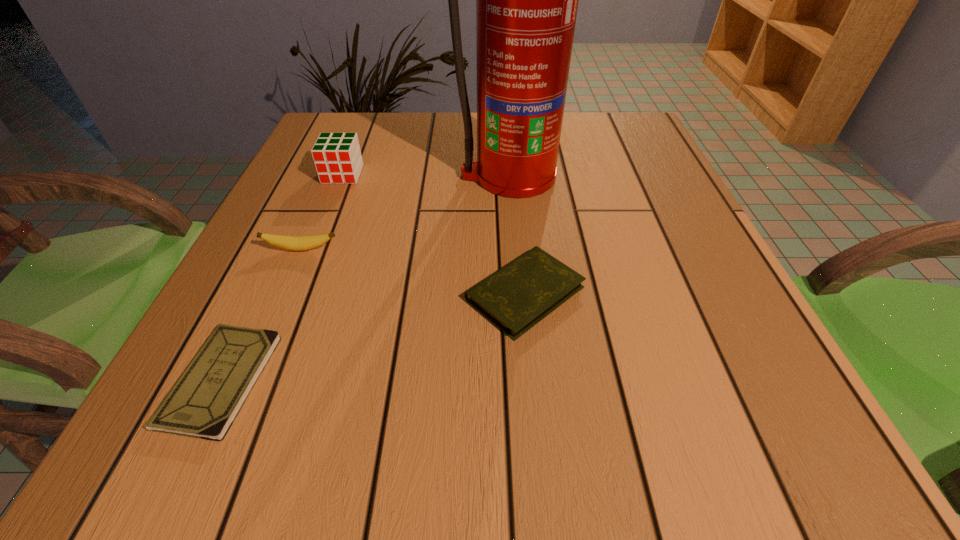
This screenshot has height=540, width=960. I want to click on fire extinguisher, so click(526, 0).

I want to click on the second tallest object, so click(x=337, y=157).

Image resolution: width=960 pixels, height=540 pixels. What are the coordinates of `banana` in the screenshot? It's located at [297, 243].

Image resolution: width=960 pixels, height=540 pixels. Identify the location of diary. (518, 296).

Locate an element on the screen. This screenshot has height=540, width=960. the shortest object is located at coordinates (203, 403).

Find the location of a particular element. The image size is (960, 540). vacant space located 0.290m on the instruction side of the fire extinguisher is located at coordinates (521, 303).

Image resolution: width=960 pixels, height=540 pixels. Find the location of `free space located 0.140m on the red face of the fourth shortest object`. free space located 0.140m on the red face of the fourth shortest object is located at coordinates coord(323,224).

The image size is (960, 540). I want to click on vacant position located 0.320m on the right of the banana, so click(514, 249).

Locate an element on the screen. free space located on the left of the diary is located at coordinates click(422, 293).

Identify the location of vacant region located on the back of the shortest object. (280, 255).